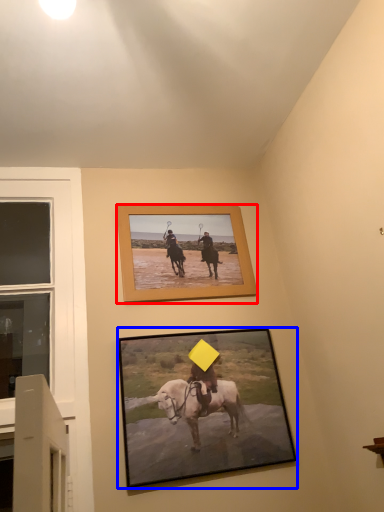
Question: Among these objects, which one is nearest to the camera, picture frame (highlighted by a red box) or picture frame (highlighted by a blue box)?

Choices:
 (A) picture frame
 (B) picture frame

Answer: (B)